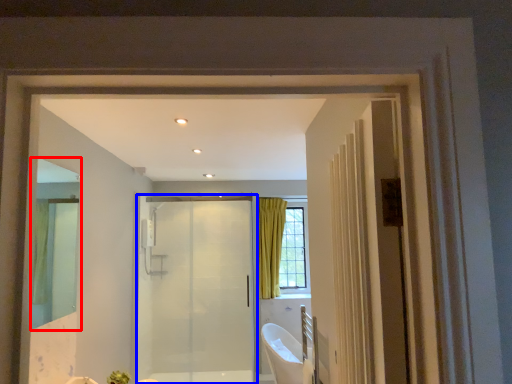
Question: Which object appears farthest to the camera in this image, mirror (highlighted by a red box) or door (highlighted by a blue box)?

Choices:
 (A) mirror
 (B) door

Answer: (B)